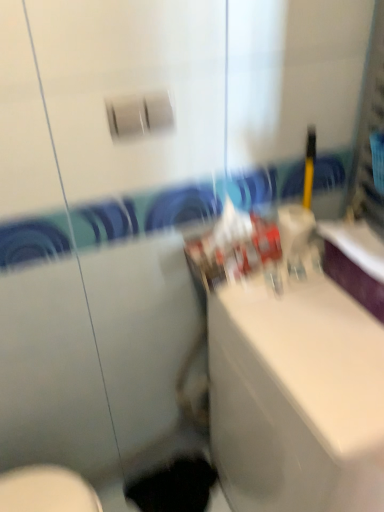
Question: Does black matte hole at lower center have a lesser height compared to white glossy sink at center?

Choices:
 (A) no
 (B) yes

Answer: (B)

Question: Does black matte hole at lower center appear on the right side of white glossy sink at center?

Choices:
 (A) yes
 (B) no

Answer: (B)

Question: Can you confirm if black matte hole at lower center is taller than white glossy sink at center?

Choices:
 (A) yes
 (B) no

Answer: (B)

Question: Is black matte hole at lower center not within white glossy sink at center?

Choices:
 (A) no
 (B) yes

Answer: (B)

Question: Is black matte hole at lower center touching white glossy sink at center?

Choices:
 (A) no
 (B) yes

Answer: (A)

Question: Can you confirm if black matte hole at lower center is thinner than white glossy sink at center?

Choices:
 (A) no
 (B) yes

Answer: (B)

Question: Would you say white glossy sink at center is a long distance from black matte hole at lower center?

Choices:
 (A) yes
 (B) no

Answer: (B)

Question: From the image's perspective, would you say white glossy sink at center is shown under black matte hole at lower center?

Choices:
 (A) yes
 (B) no

Answer: (B)

Question: Is white glossy sink at center behind black matte hole at lower center?

Choices:
 (A) yes
 (B) no

Answer: (B)

Question: Does white glossy sink at center have a lesser height compared to black matte hole at lower center?

Choices:
 (A) no
 (B) yes

Answer: (A)

Question: Considering the relative sizes of white glossy sink at center and black matte hole at lower center in the image provided, is white glossy sink at center taller than black matte hole at lower center?

Choices:
 (A) no
 (B) yes

Answer: (B)

Question: Is white glossy sink at center at the left side of black matte hole at lower center?

Choices:
 (A) no
 (B) yes

Answer: (A)

Question: In terms of size, does white glossy sink at center appear bigger or smaller than black matte hole at lower center?

Choices:
 (A) big
 (B) small

Answer: (A)